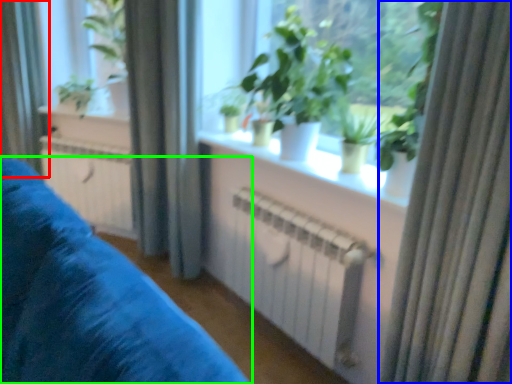
Question: Estimate the real-world distances between objects in this image. Which object is closer to curtain (highlighted by a red box), curtain (highlighted by a blue box) or furniture (highlighted by a green box)?

Choices:
 (A) curtain
 (B) furniture

Answer: (B)